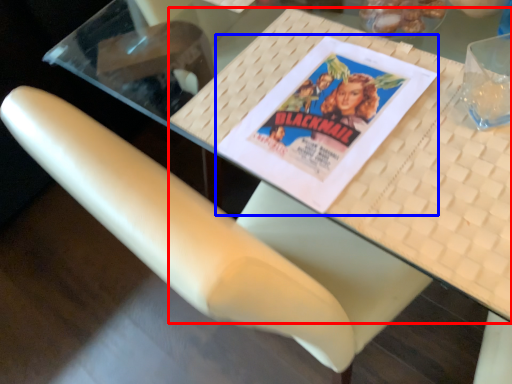
Question: Among these objects, which one is nearest to the camera, table (highlighted by a red box) or paperback book (highlighted by a blue box)?

Choices:
 (A) table
 (B) paperback book

Answer: (A)